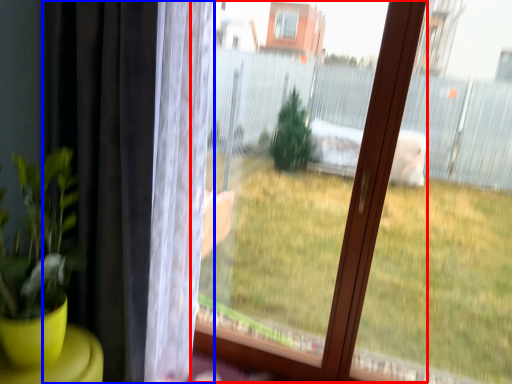
Question: Which of the following is the farthest to the observer, bay window (highlighted by a red box) or curtain (highlighted by a blue box)?

Choices:
 (A) bay window
 (B) curtain

Answer: (A)